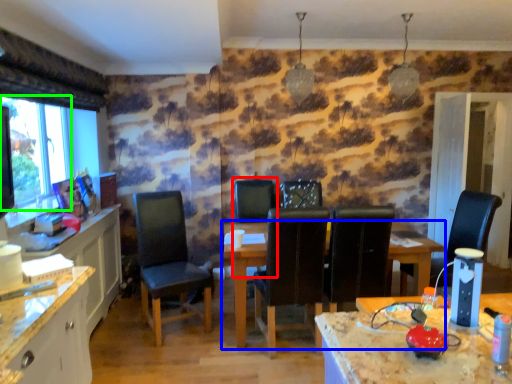
Question: Which is nearer to the armchair (highlighted by a red box)? table (highlighted by a blue box) or window screen (highlighted by a green box).

Choices:
 (A) table
 (B) window screen

Answer: (A)